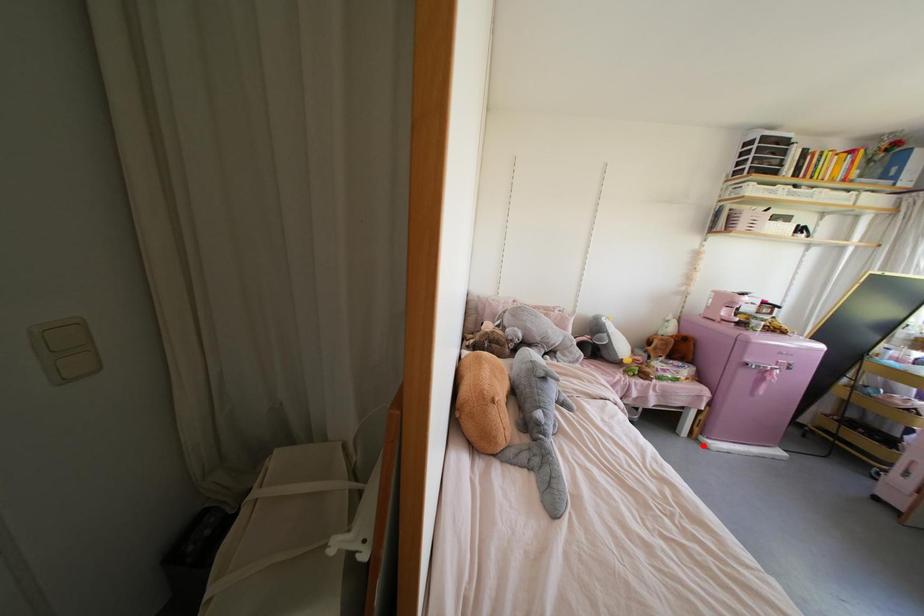
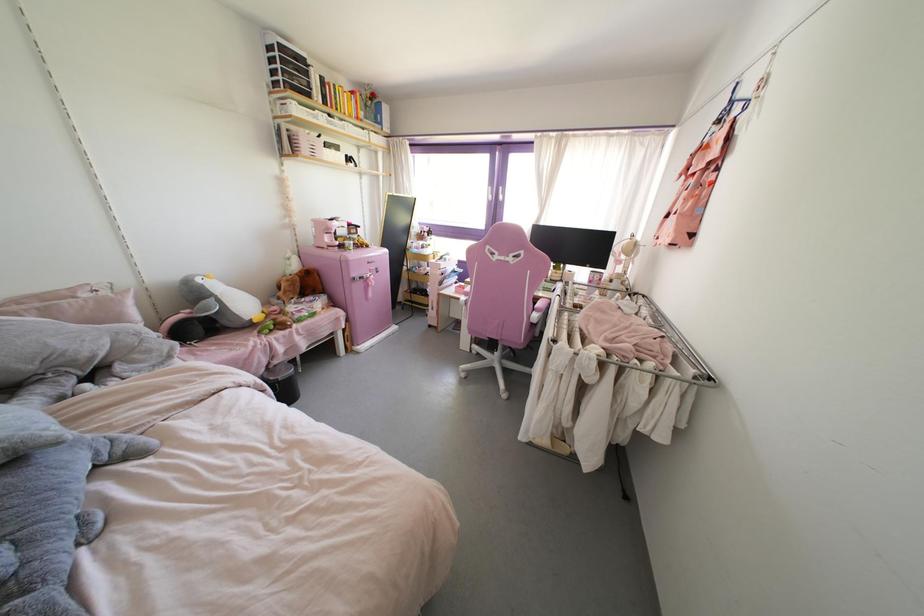
Question: I am providing you with two images of the same scene from different viewpoints. In image1, a red point is highlighted. Considering the same 3D point in image2, which of the following is correct?

Choices:
 (A) It is closer
 (B) It is farther

Answer: (B)